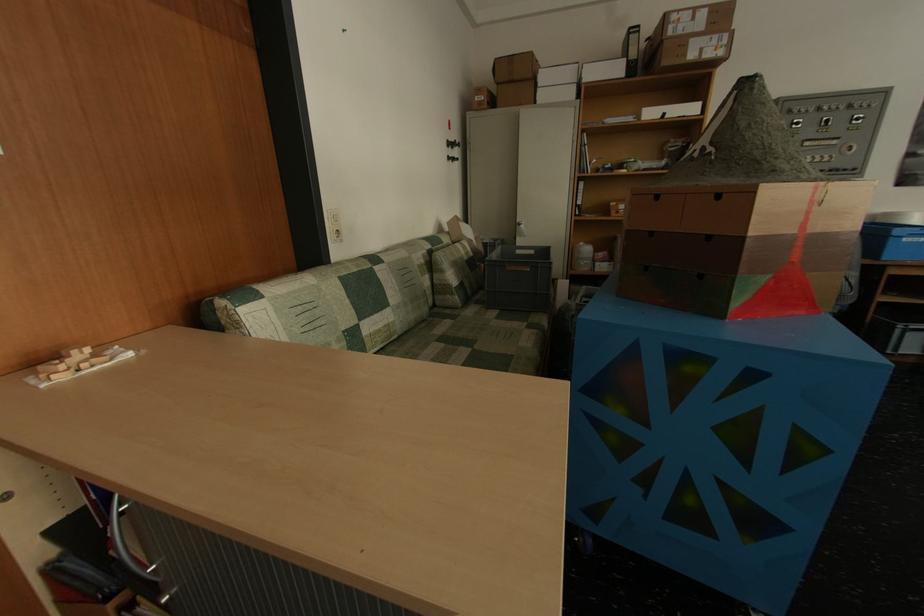
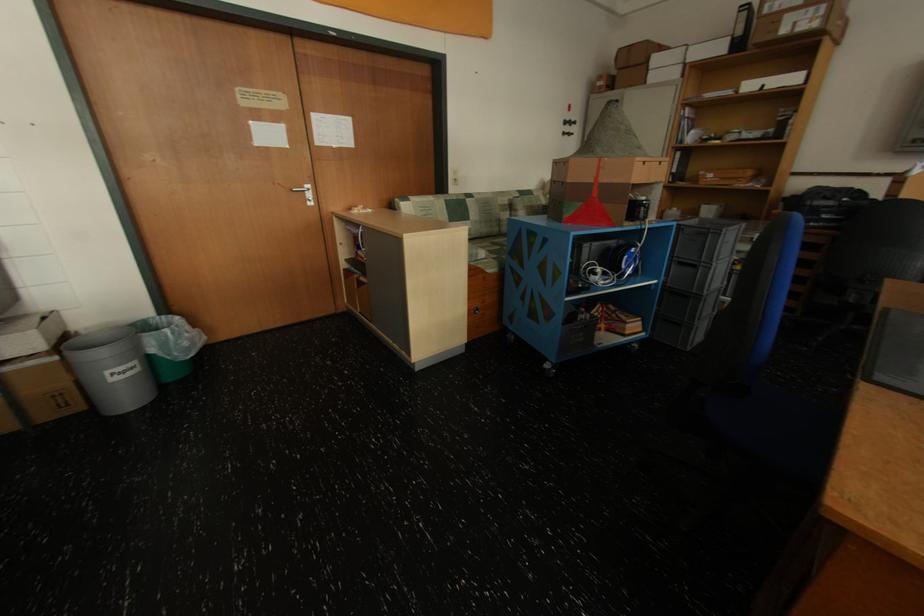
The point at (x=626, y=71) is marked in the first image. Where is the corresponding point in the second image?

(728, 50)